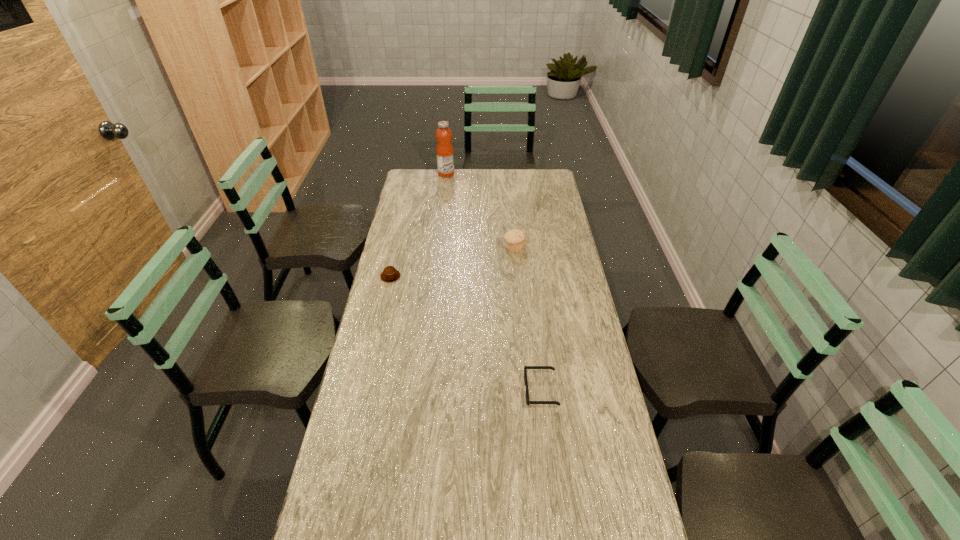
The height and width of the screenshot is (540, 960). What are the coordinates of `vacant area located 0.190m on the back of the second nearest object` in the screenshot? It's located at (398, 242).

The image size is (960, 540). I want to click on free space located 0.190m on the front-facing side of the sunglasses, so click(465, 390).

You are a GUI agent. You are given a task and a screenshot of the screen. Output one action in this format:
    pyautogui.click(x=<x>, y=<y>)
    Task: Click on the vacant area located 0.230m on the front-facing side of the sunglasses
    The width and height of the screenshot is (960, 540).
    Given the screenshot: What is the action you would take?
    pyautogui.click(x=452, y=390)

You are a GUI agent. You are given a task and a screenshot of the screen. Output one action in this format:
    pyautogui.click(x=<x>, y=<y>)
    Task: Click on the free space located 0.190m on the front-facing side of the sunglasses
    
    Given the screenshot: What is the action you would take?
    pyautogui.click(x=465, y=390)

At what (x,y) coordinates should I click in order to perform the action: click on object that is at the far edge. Please return your answer as a coordinate pair (x, y). The width and height of the screenshot is (960, 540). Looking at the image, I should click on (445, 155).

Find the location of a particular element. The height and width of the screenshot is (540, 960). object situated at the left edge is located at coordinates (390, 274).

The height and width of the screenshot is (540, 960). What are the coordinates of `object that is at the right edge` in the screenshot? It's located at (528, 402).

The image size is (960, 540). Find the location of `free space at the far edge`. free space at the far edge is located at coordinates (460, 177).

At what (x,y) coordinates should I click in order to perform the action: click on free space at the left edge of the desktop. Please return your answer as a coordinate pair (x, y). Looking at the image, I should click on (360, 469).

Where is `vacant space at the right edge`? This screenshot has width=960, height=540. vacant space at the right edge is located at coordinates (549, 239).